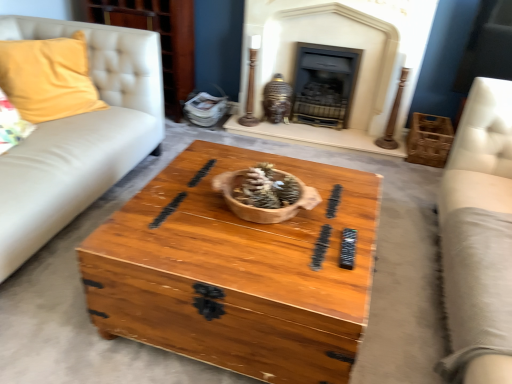
Question: Would you say wooden crate at right is to the left or to the right of matte white dresser at upper left in the picture?

Choices:
 (A) right
 (B) left

Answer: (A)

Question: In the image, is wooden crate at right positioned in front of or behind matte white dresser at upper left?

Choices:
 (A) behind
 (B) front

Answer: (B)

Question: Which is nearer to the matte black fireplace at upper center, which is the first fireplace in left-to-right order?

Choices:
 (A) yellow fabric pillow at left
 (B) matte white dresser at upper left
 (C) wooden crate at right
 (D) dark gray stone fireplace at center, the first fireplace when ordered from right to left
 (E) light beige leather couch at right

Answer: (D)

Question: Which of these objects is positioned farthest from the yellow fabric pillow at left?

Choices:
 (A) matte white dresser at upper left
 (B) wooden chest at center
 (C) light beige leather couch at right
 (D) matte black fireplace at upper center, the second fireplace from the right
 (E) wooden crate at right

Answer: (E)